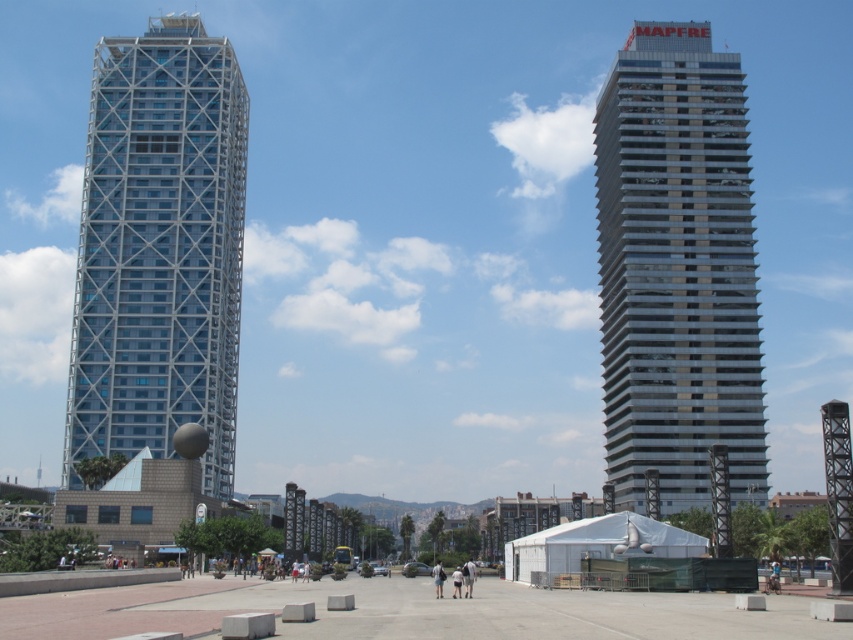
Who is more distant from viewer, (666, 81) or (175, 122)?

Point (175, 122)

Identify the location of glassy silver skyscraper at right. This screenshot has height=640, width=853. (677, 269).